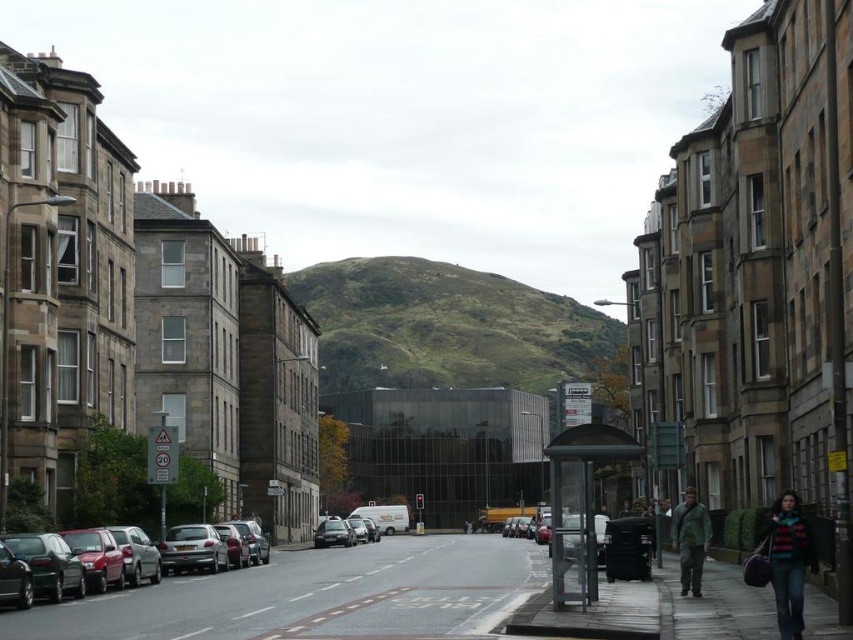
Question: Which is nearer to the metallic silver bus stop at center?

Choices:
 (A) concrete sidewalk at center
 (B) matte black car at left
 (C) striped sweater at lower right

Answer: (C)

Question: Can you confirm if metallic silver bus stop at center is bigger than green textured jacket at lower right?

Choices:
 (A) no
 (B) yes

Answer: (B)

Question: Is concrete sidewalk at center behind silver metallic hatchback at lower left?

Choices:
 (A) yes
 (B) no

Answer: (B)

Question: Estimate the real-world distances between objects in this image. Which object is closer to the green textured jacket at lower right?

Choices:
 (A) green grassy hill at center
 (B) striped sweater at lower right
 (C) metallic silver bus stop at center
 (D) silver metallic hatchback at lower left

Answer: (C)

Question: Considering the real-world distances, which object is farthest from the metallic silver bus stop at center?

Choices:
 (A) green grassy hill at center
 (B) silver metallic hatchback at lower left
 (C) striped sweater at lower right

Answer: (A)

Question: Where is concrete sidewalk at center located in relation to silver metallic hatchback at lower left in the image?

Choices:
 (A) left
 (B) right

Answer: (B)